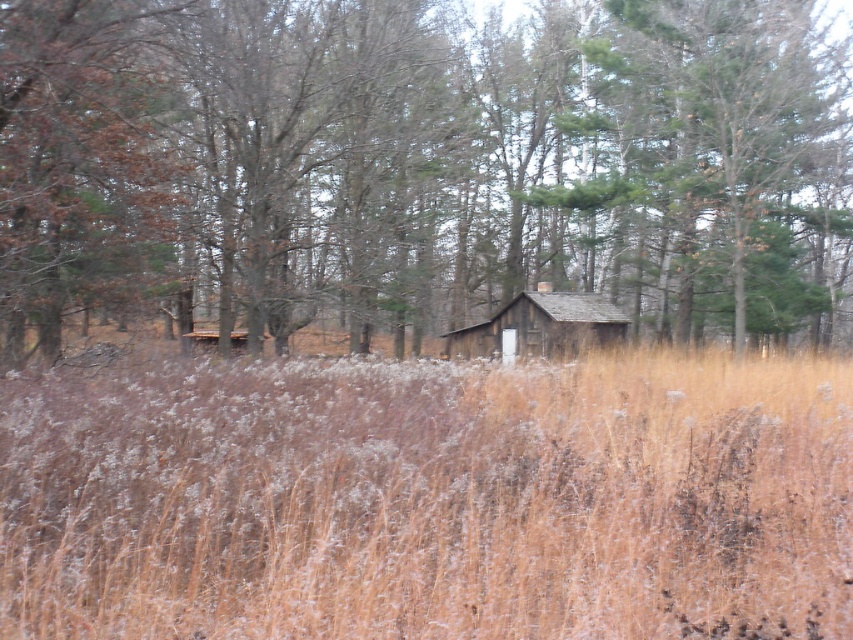
Question: Does brown wood tree at center have a lesser width compared to wooden cabin at center?

Choices:
 (A) yes
 (B) no

Answer: (B)

Question: Which point appears farthest from the camera in this image?

Choices:
 (A) (622, 100)
 (B) (595, 340)

Answer: (A)

Question: From the image, what is the correct spatial relationship of brown wood tree at center in relation to brown dry grass at center?

Choices:
 (A) right
 (B) left

Answer: (A)

Question: Which object is positioned farthest from the brown wood tree at center?

Choices:
 (A) wooden cabin at center
 (B) brown dry grass at center

Answer: (B)

Question: Which object appears closest to the camera in this image?

Choices:
 (A) brown wood tree at center
 (B) wooden cabin at center
 (C) brown dry grass at center

Answer: (C)

Question: Is brown dry grass at center behind wooden cabin at center?

Choices:
 (A) no
 (B) yes

Answer: (A)